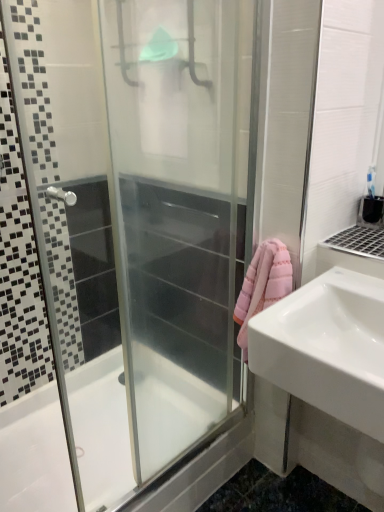
Question: In terms of width, does transparent glass shower door at center look wider or thinner when compared to white glossy bathtub at lower left?

Choices:
 (A) wide
 (B) thin

Answer: (B)

Question: In terms of size, does transparent glass shower door at center appear bigger or smaller than white glossy bathtub at lower left?

Choices:
 (A) small
 (B) big

Answer: (A)

Question: Considering the real-world distances, which object is farthest from the transparent glass shower door at center?

Choices:
 (A) white glossy sink at right
 (B) white glossy bathtub at lower left

Answer: (B)

Question: Estimate the real-world distances between objects in this image. Which object is closer to the white glossy bathtub at lower left?

Choices:
 (A) white glossy sink at right
 (B) transparent glass shower door at center

Answer: (B)